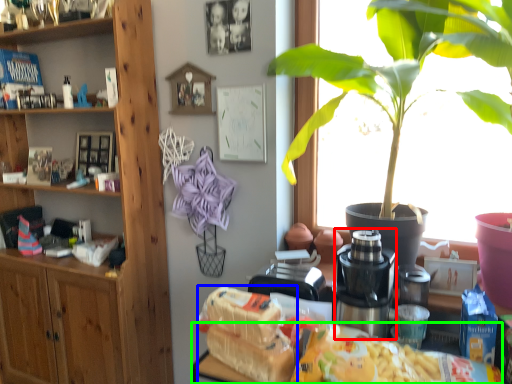
Question: Which object is the farthest from coffee machine (highlighted by a red box)? Choose among these: food (highlighted by a blue box) or desk (highlighted by a green box).

Choices:
 (A) food
 (B) desk

Answer: (A)